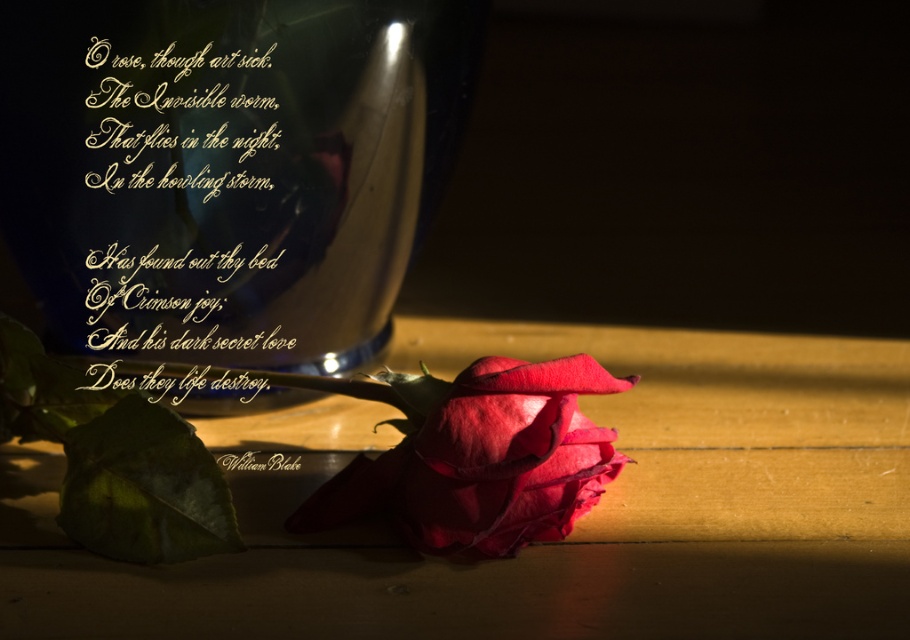
You are examining the image of the rose and the vase. There are two points marked in the image. Which point is closer to you, point (18, 552) or point (94, 285)?

Point (18, 552) is closer to the viewer than point (94, 285).

You are setting up a small display and have a decorative item that is 10 inches wide. You want to place it on the wooden table at lower center without overlapping the gold calligraphy at upper left. Is the table wide enough to accommodate this?

The wooden table at lower center is wider than the gold calligraphy at upper left, so placing a 10 inch wide decorative item on the wooden table at lower center without overlapping the gold calligraphy at upper left should be possible as long as it is positioned appropriately.

You are standing in front of the image of a wilted red rose on a wooden surface with a dark blue vase behind it. There is a point marked at coordinates point (18, 120). If you want to touch this point with a ruler that is 25 inches long, will the ruler reach it?

The point (18, 120) is 28.47 inches away from the viewer. Since the ruler is only 25 inches long, it will not reach the point.